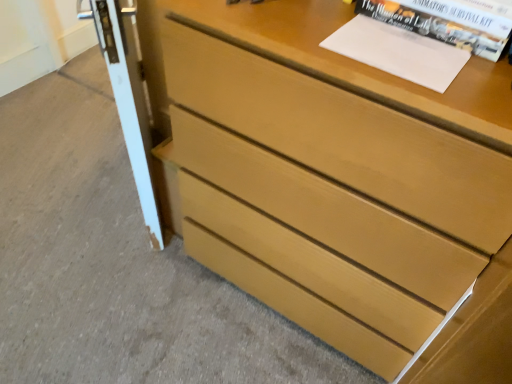
Find the location of a particular element. vacant space underneath white paper at upper right (from a real-world perspective) is located at coordinates (392, 47).